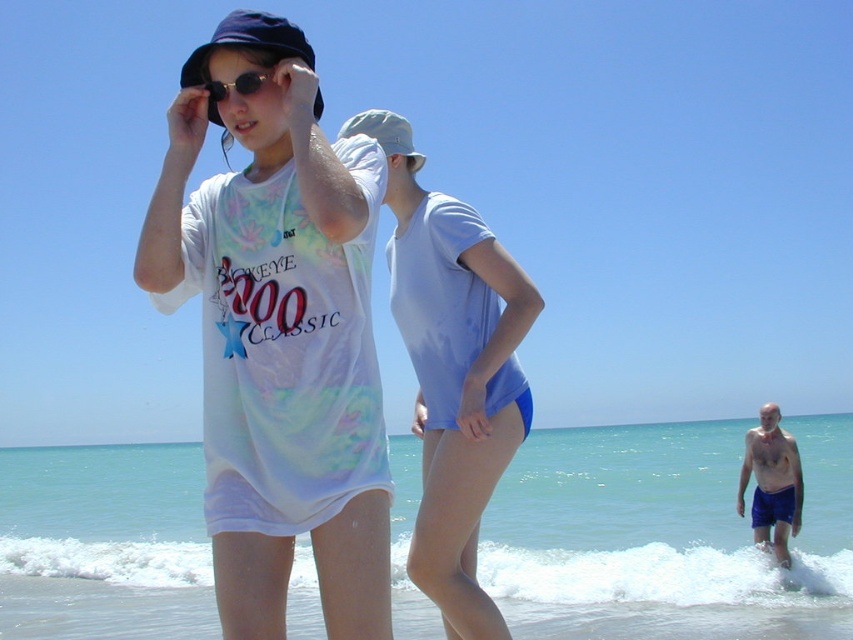
Question: Is light blue swimsuit at center above sunglasses at center?

Choices:
 (A) no
 (B) yes

Answer: (A)

Question: Can you confirm if tie-dye fabric shirt at center is wider than smooth blue shorts at lower right?

Choices:
 (A) yes
 (B) no

Answer: (A)

Question: Which object is farther from the camera taking this photo?

Choices:
 (A) tie-dye fabric shirt at center
 (B) matte blue baseball hat at upper left

Answer: (B)

Question: Which point is closer to the camera taking this photo?

Choices:
 (A) (248, 33)
 (B) (749, 454)
 (C) (210, 109)
 (D) (448, 632)

Answer: (A)

Question: Is tie-dye fabric shirt at center behind matte blue baseball hat at upper left?

Choices:
 (A) yes
 (B) no

Answer: (B)

Question: Which object appears closest to the camera in this image?

Choices:
 (A) light blue swimsuit at center
 (B) matte blue baseball hat at upper left
 (C) smooth blue shorts at lower right

Answer: (B)